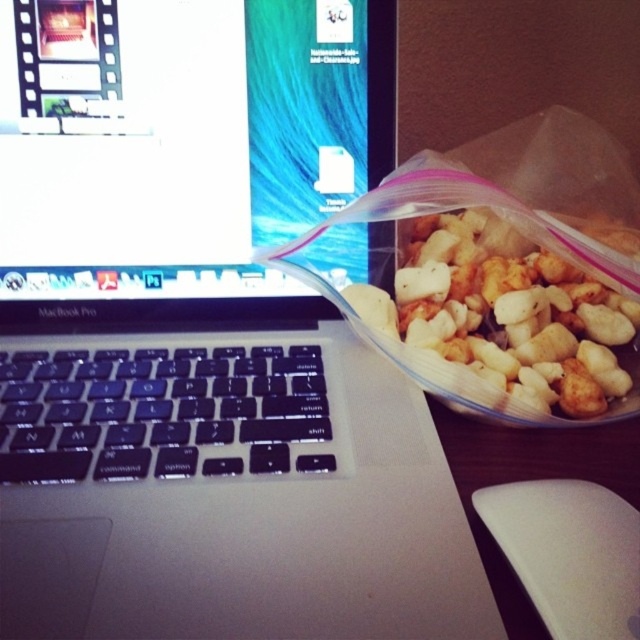
Question: Is matte plastic computer screen at upper left above white matte mouse at lower right?

Choices:
 (A) yes
 (B) no

Answer: (A)

Question: Which point is farther to the camera?

Choices:
 (A) (525, 573)
 (B) (600, 410)

Answer: (B)

Question: Can you confirm if matte plastic computer screen at upper left is positioned below white matte nuts at center?

Choices:
 (A) yes
 (B) no

Answer: (B)

Question: Can you confirm if white matte nuts at center is wider than white matte mouse at lower right?

Choices:
 (A) yes
 (B) no

Answer: (A)

Question: Which is nearer to the white matte mouse at lower right?

Choices:
 (A) matte plastic computer screen at upper left
 (B) white matte nuts at center

Answer: (B)

Question: Estimate the real-world distances between objects in this image. Which object is farther from the matte plastic computer screen at upper left?

Choices:
 (A) white matte nuts at center
 (B) white matte mouse at lower right

Answer: (B)